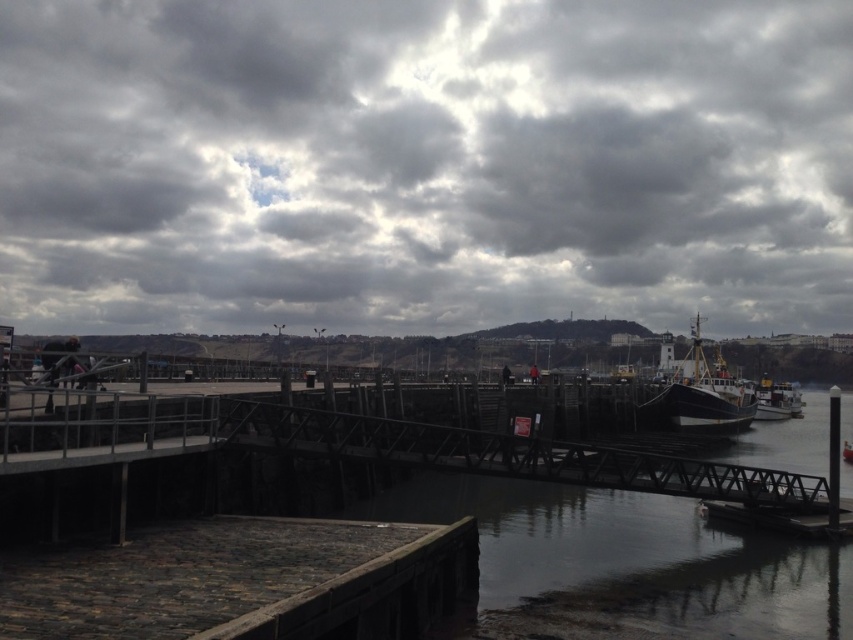
Question: Among these points, which one is farthest from the camera?

Choices:
 (A) (314, 177)
 (B) (196, 588)
 (C) (688, 376)

Answer: (A)

Question: From the image, what is the correct spatial relationship of stone cobblestone dock at lower left in relation to metallic gray bridge at center?

Choices:
 (A) above
 (B) below

Answer: (B)

Question: Can you confirm if stone cobblestone dock at lower left is wider than metallic gray bridge at center?

Choices:
 (A) yes
 (B) no

Answer: (B)

Question: Which object is the closest to the metallic gray bridge at center?

Choices:
 (A) cloudy sky at upper center
 (B) stone cobblestone dock at lower left

Answer: (B)

Question: Does metallic gray bridge at center lie in front of wooden ship at right?

Choices:
 (A) no
 (B) yes

Answer: (B)

Question: Which object is farther from the camera taking this photo?

Choices:
 (A) cloudy sky at upper center
 (B) stone cobblestone dock at lower left
 (C) metallic gray bridge at center
 (D) wooden ship at right

Answer: (A)